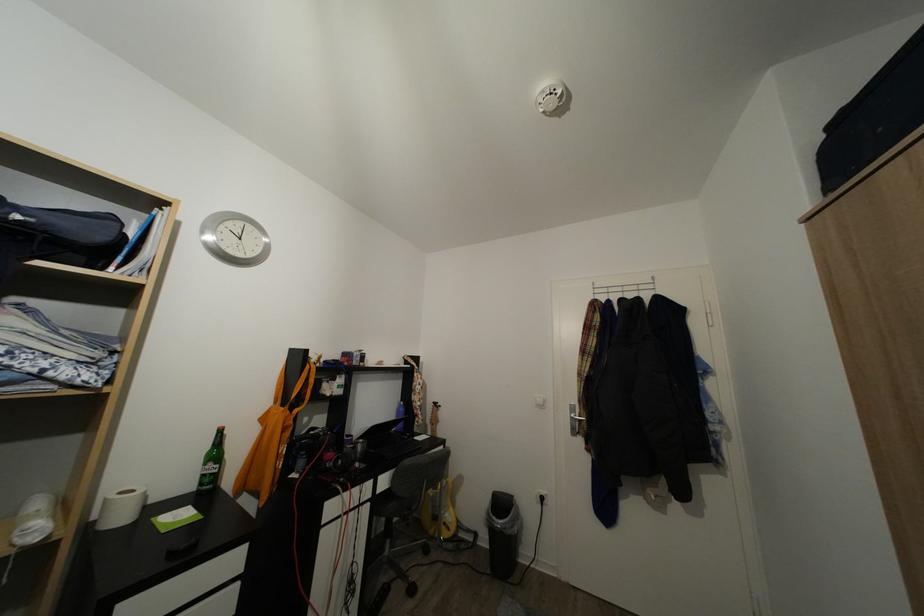
Identify the location of white light switch. The height and width of the screenshot is (616, 924). (540, 402).